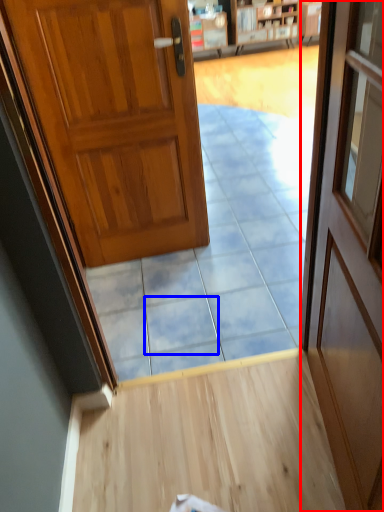
Question: Among these objects, which one is farthest to the camera, door (highlighted by a red box) or tile (highlighted by a blue box)?

Choices:
 (A) door
 (B) tile

Answer: (B)